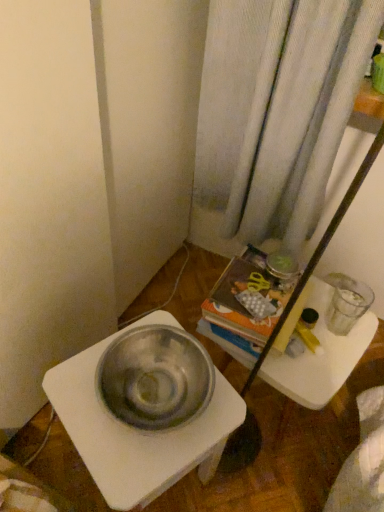
Question: Based on their sizes in the image, would you say translucent plastic tray at center is bigger or smaller than metallic white table at lower left?

Choices:
 (A) small
 (B) big

Answer: (A)

Question: Considering their positions, is translucent plastic tray at center located in front of or behind metallic white table at lower left?

Choices:
 (A) behind
 (B) front

Answer: (A)

Question: Would you say translucent plastic tray at center is to the left or to the right of metallic white table at lower left in the picture?

Choices:
 (A) left
 (B) right

Answer: (B)

Question: Visually, is metallic white table at lower left positioned to the left or to the right of translucent plastic tray at center?

Choices:
 (A) left
 (B) right

Answer: (A)

Question: Choose the correct answer: Is metallic white table at lower left inside translucent plastic tray at center or outside it?

Choices:
 (A) outside
 (B) inside

Answer: (A)

Question: Based on their sizes in the image, would you say metallic white table at lower left is bigger or smaller than translucent plastic tray at center?

Choices:
 (A) big
 (B) small

Answer: (A)

Question: From a real-world perspective, is metallic white table at lower left above or below translucent plastic tray at center?

Choices:
 (A) above
 (B) below

Answer: (A)